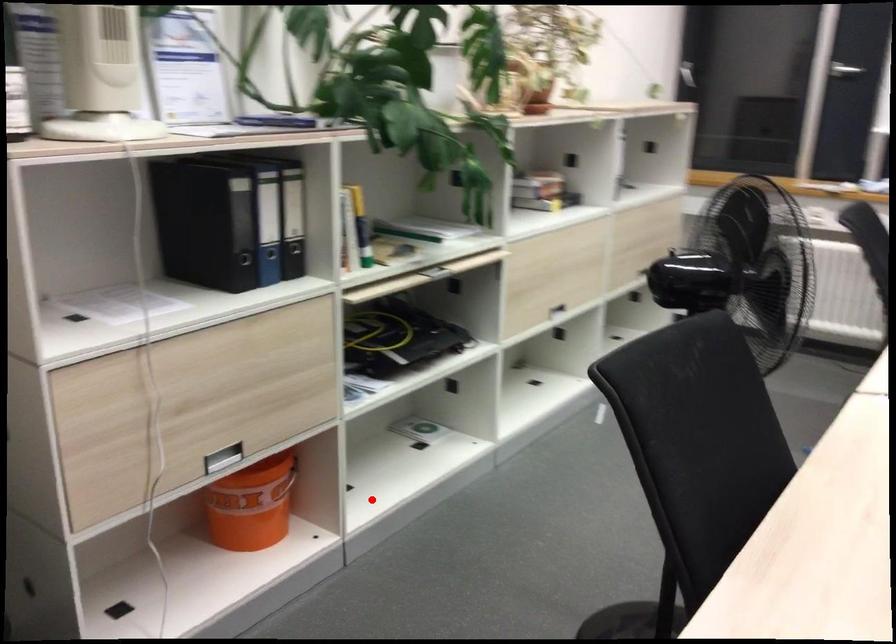
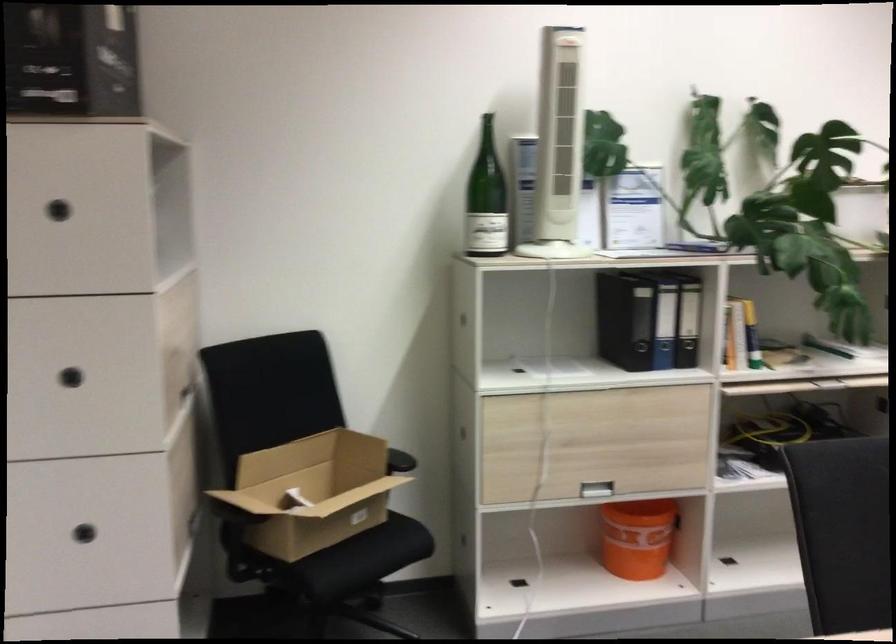
Question: I am providing you with two images of the same scene from different viewpoints. Given a red point in image1, look at the same physical point in image2. Is it:

Choices:
 (A) Closer to the viewpoint
 (B) Farther from the viewpoint

Answer: (B)